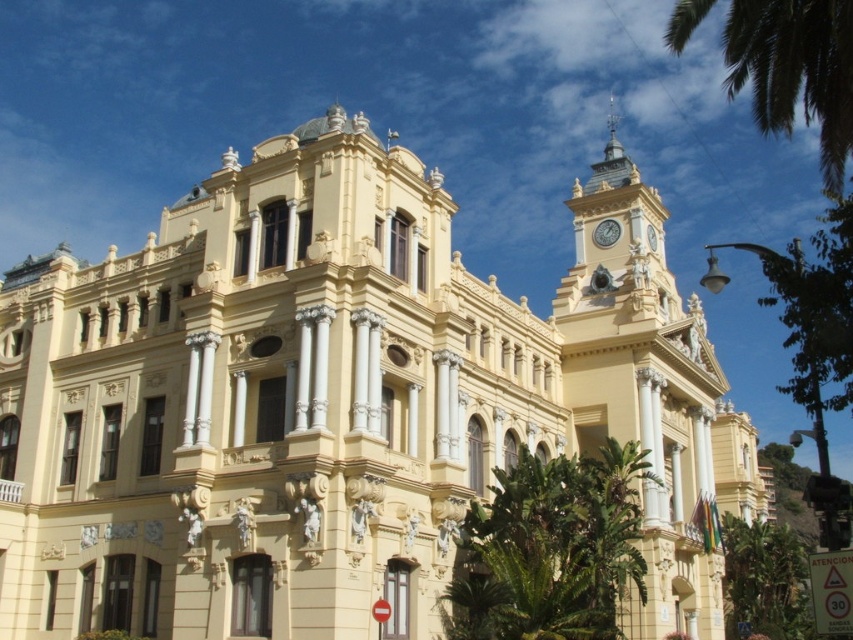
You are standing in front of the grand ornate building and want to take a photo of the point at coordinate point (x=735, y=588). Your camera has a maximum focusing distance of 80 meters. Will you be able to focus on the point?

The distance of point (x=735, y=588) from the camera is 85.76 meters, which exceeds the camera maximum focusing distance of 80 meters. Therefore, you will not be able to focus on the point.

You are standing in front of the grand building and see the green leafy palm tree at lower right and the metallic clock at upper right. Which object is positioned more to the right side of the building?

The green leafy palm tree at lower right is positioned more to the right side of the building than the metallic clock at upper right.